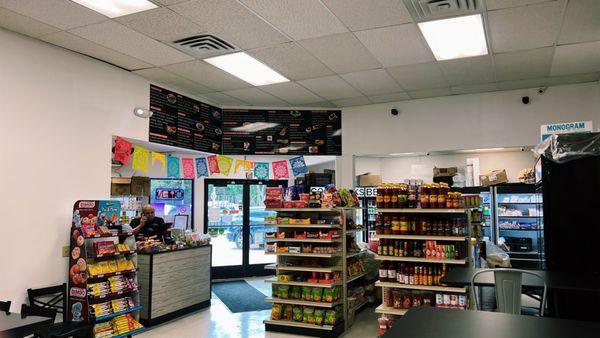
This screenshot has width=600, height=338. In order to click on tables in this screenshot , I will do `click(14, 325)`, `click(493, 324)`, `click(460, 275)`.